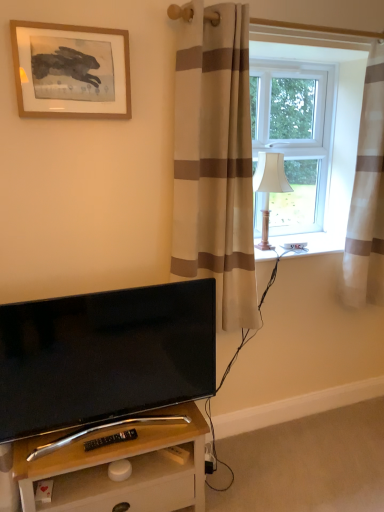
Locate an element on the screen. This screenshot has width=384, height=512. vacant area that lies between black glossy tv at lower left and black plastic remote control at lower center is located at coordinates (136, 440).